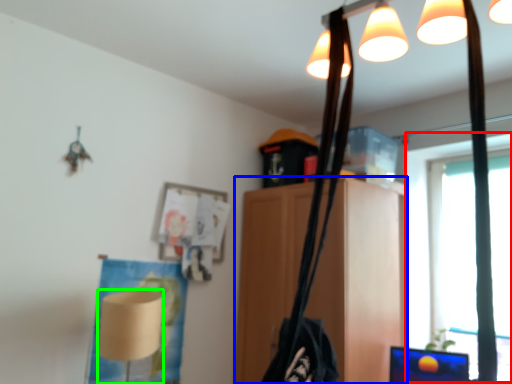
Question: Considering the real-world distances, which object is closest to window screen (highlighted by a red box)? furniture (highlighted by a blue box) or lamp (highlighted by a green box).

Choices:
 (A) furniture
 (B) lamp

Answer: (A)